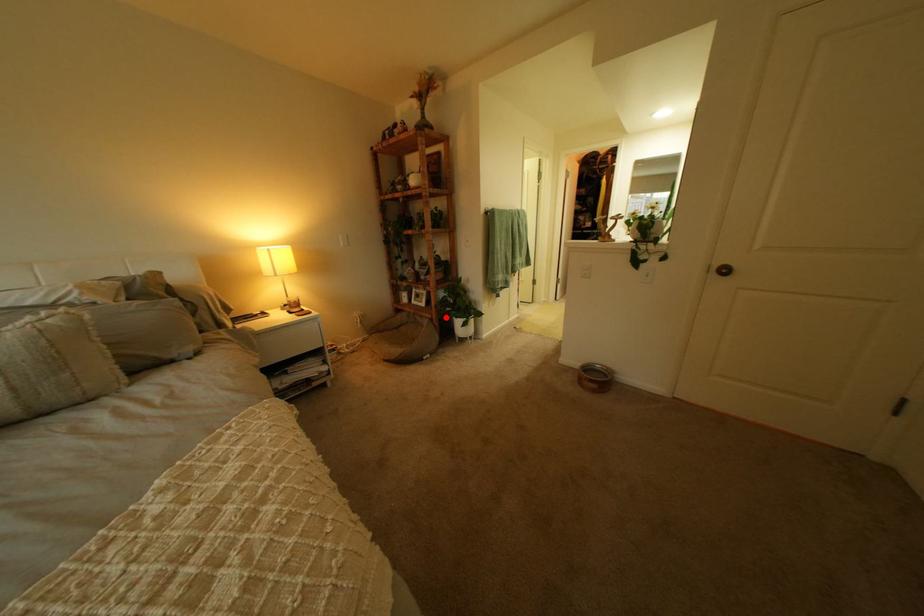
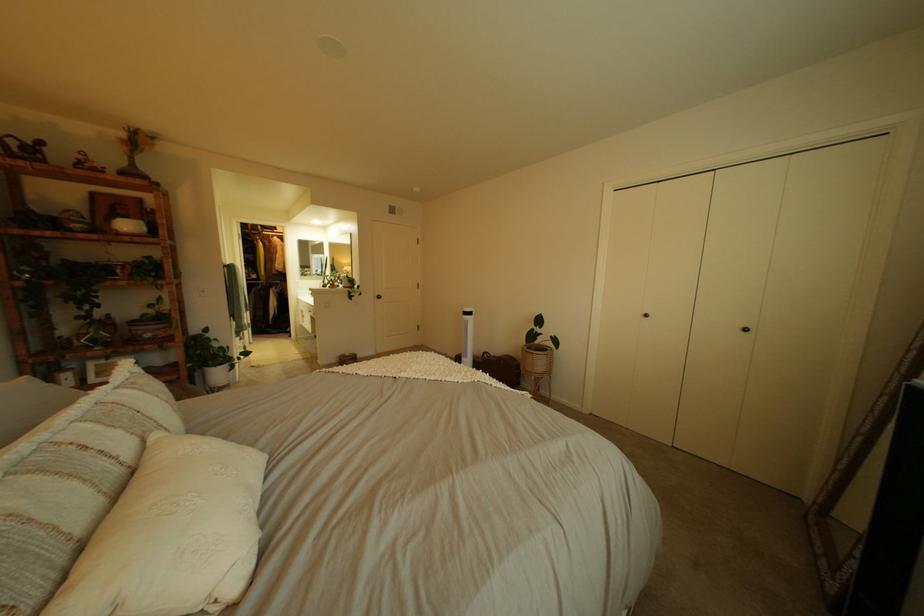
The point at the highlighted location is marked in the first image. Where is the corresponding point in the second image?

(189, 379)